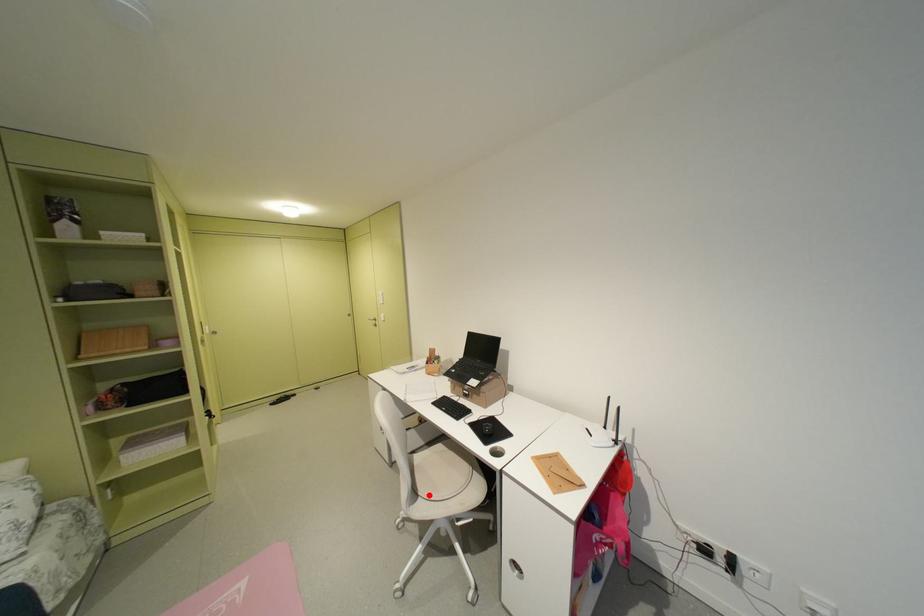
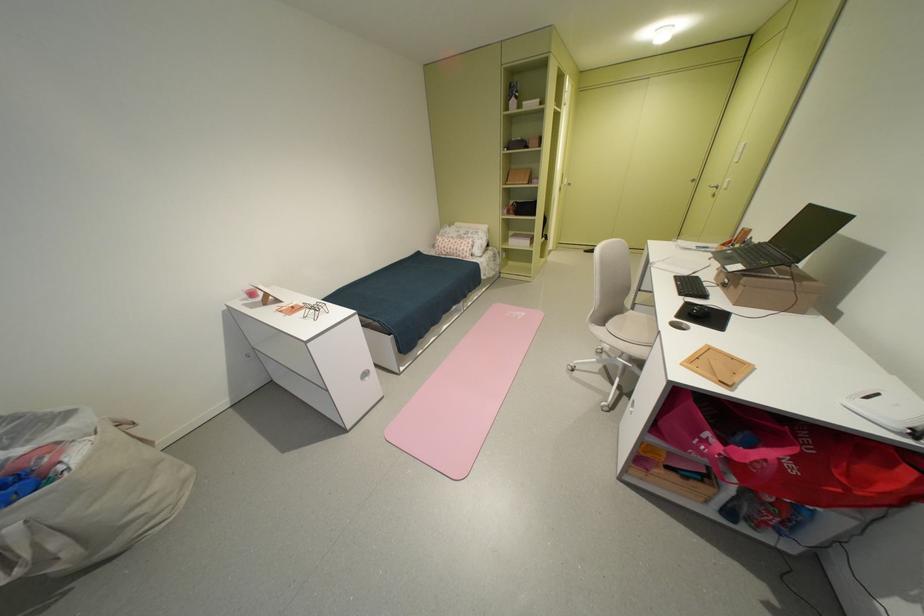
Where in the second image is the point corresponding to the highlighted location from the first image?

(615, 326)